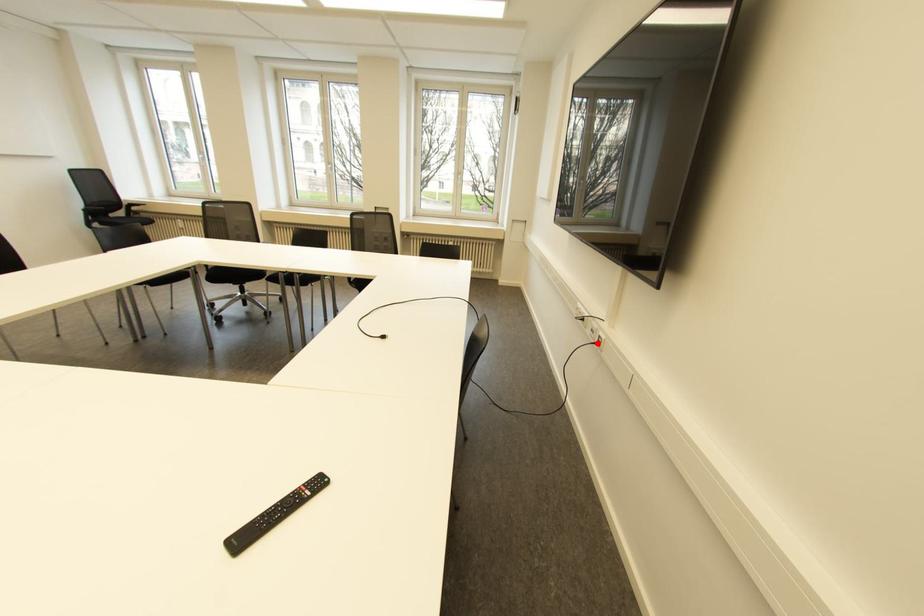
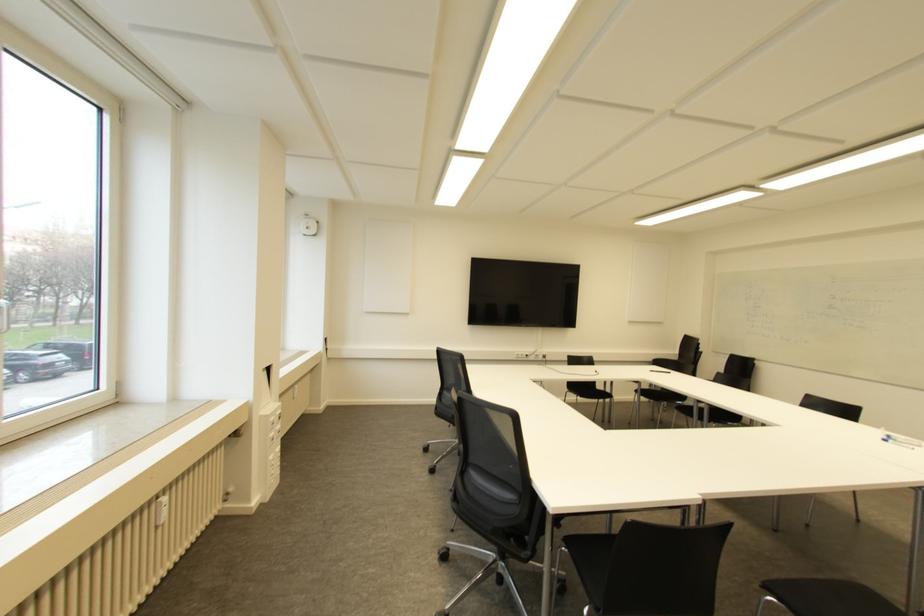
Question: I am providing you with two images of the same scene from different viewpoints. A red point is marked on the first image. Can you still see the location of the red point in image 2?

Choices:
 (A) Yes
 (B) No

Answer: (A)